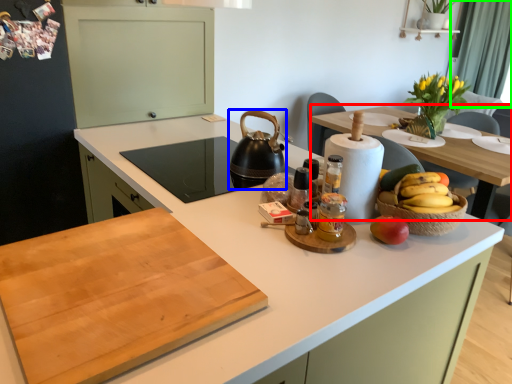
Question: Which object is the farthest from table (highlighted by a red box)? Choose among these: kitchen appliance (highlighted by a blue box) or curtain (highlighted by a green box).

Choices:
 (A) kitchen appliance
 (B) curtain

Answer: (B)